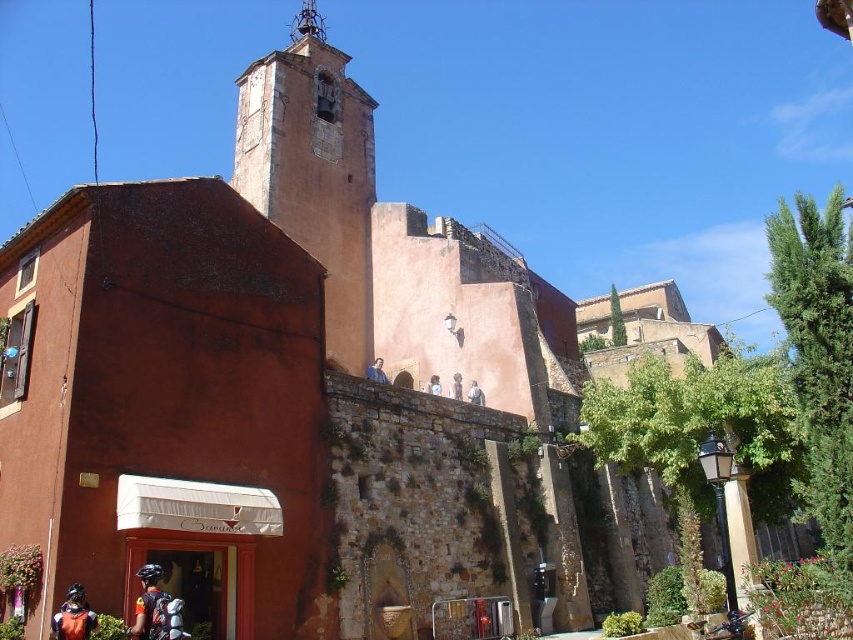
Which is more to the right, orange fabric helmet at lower left or light blue fabric at upper center?

From the viewer's perspective, light blue fabric at upper center appears more on the right side.

Is point (91, 611) closer to camera compared to point (428, 390)?

Yes.

Measure the distance between point (x=83, y=628) and camera.

A distance of 104.37 feet exists between point (x=83, y=628) and camera.

Locate an element on the screen. orange fabric helmet at lower left is located at coordinates (73, 616).

The height and width of the screenshot is (640, 853). Describe the element at coordinates (376, 371) in the screenshot. I see `smooth skin face at upper center` at that location.

Who is positioned more to the left, smooth skin face at upper center or matte gray statue at upper center?

smooth skin face at upper center

Who is more forward, (386, 381) or (469, 390)?

Point (469, 390)

The image size is (853, 640). Identify the location of smooth skin face at upper center. (376, 371).

Does shiny blue helmet at lower left have a lesser height compared to orange fabric helmet at lower left?

No, shiny blue helmet at lower left is not shorter than orange fabric helmet at lower left.

Identify the location of shiny blue helmet at lower left. (148, 604).